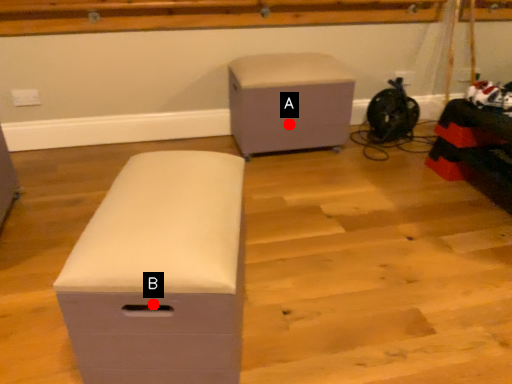
Question: Two points are circled on the image, labeled by A and B beside each circle. Which point is further to the camera?

Choices:
 (A) A is further
 (B) B is further

Answer: (A)